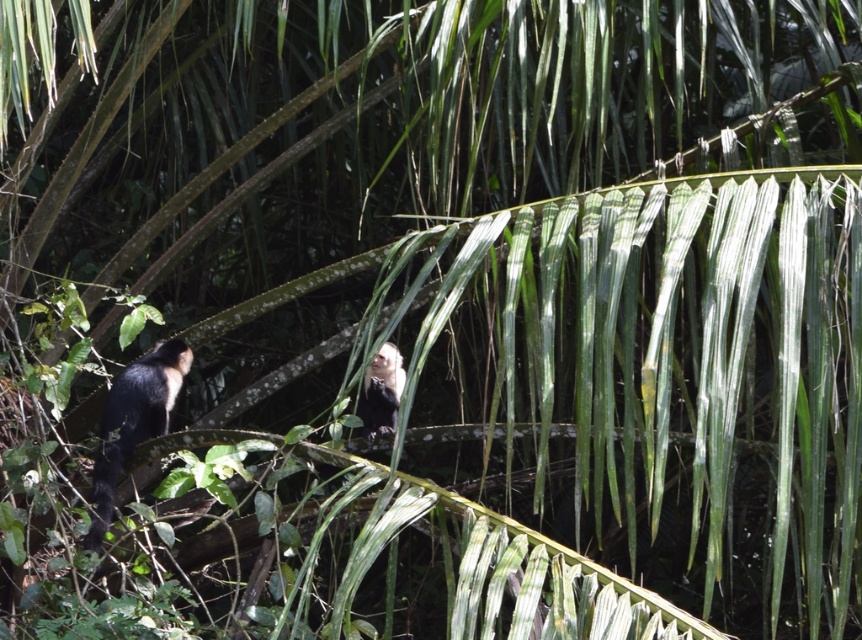
You are a photographer trying to capture a clear photo of the two points in the forest scene. If you focus on the point at coordinates point (98, 493), will the other point point (385, 355) be in focus as well?

Point 0.773, 0116 is in front of point (385, 355). If you focus on the point at coordinates point (98, 493), the other point point (385, 355) may not be in focus because it is further away from the camera.

You are a wildlife photographer using a camera with a 100mm lens. You are standing in the forest and see the black fur monkey at left. Can you capture a clear closeup of the monkey without moving closer than your current position?

The black fur monkey at left and camera are 12.82 feet apart from each other. A 100mm lens can effectively capture closeup shots from distances of about 10 to 15 feet, so yes, you can capture a clear closeup of the black fur monkey at left without moving closer.